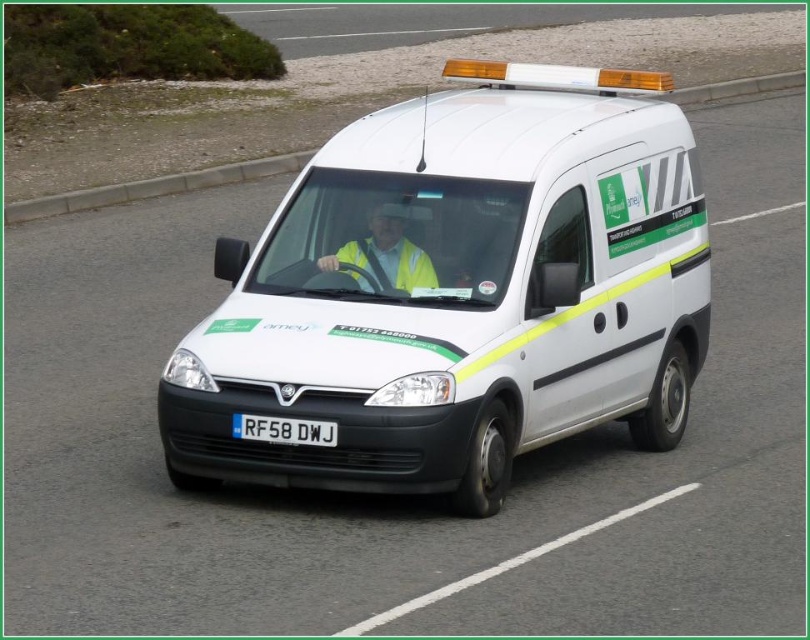
Question: Which is nearer to the white matte van at center?

Choices:
 (A) yellow reflective vest at center
 (B) white plastic license plate at center

Answer: (A)

Question: Which point appears closest to the camera in this image?

Choices:
 (A) (330, 440)
 (B) (522, 163)

Answer: (A)

Question: Can you confirm if yellow reflective vest at center is positioned above white plastic license plate at center?

Choices:
 (A) no
 (B) yes

Answer: (B)

Question: Which of the following is the closest to the observer?

Choices:
 (A) (420, 336)
 (B) (288, 426)
 (C) (340, 253)

Answer: (B)

Question: Is white matte van at center to the left of yellow reflective vest at center from the viewer's perspective?

Choices:
 (A) no
 (B) yes

Answer: (A)

Question: Can you confirm if yellow reflective vest at center is positioned to the left of white plastic license plate at center?

Choices:
 (A) no
 (B) yes

Answer: (A)